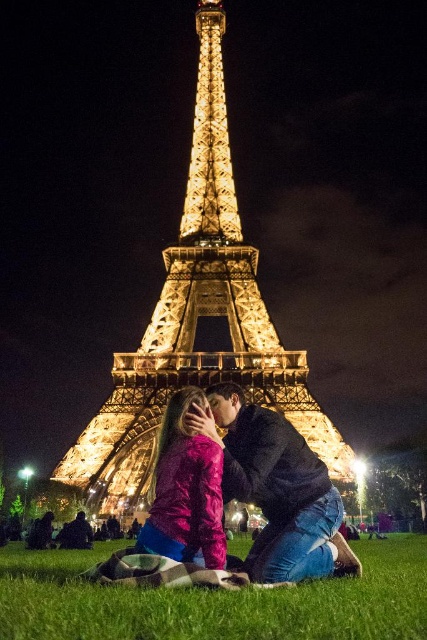
Question: Which is farther from the shiny pink jacket at center?

Choices:
 (A) black matte jacket at center
 (B) green grass at lower center

Answer: (B)

Question: Does green grass at lower center appear over black matte jacket at center?

Choices:
 (A) no
 (B) yes

Answer: (A)

Question: Which of the following is the closest to the observer?

Choices:
 (A) shiny pink jacket at center
 (B) black matte jacket at center
 (C) green grass at lower center

Answer: (C)

Question: Does black matte jacket at center have a lesser width compared to shiny pink jacket at center?

Choices:
 (A) yes
 (B) no

Answer: (B)

Question: Which point is farther to the camera?

Choices:
 (A) (321, 614)
 (B) (201, 550)
 (C) (274, 468)

Answer: (C)

Question: Does green grass at lower center come in front of black matte jacket at center?

Choices:
 (A) no
 (B) yes

Answer: (B)